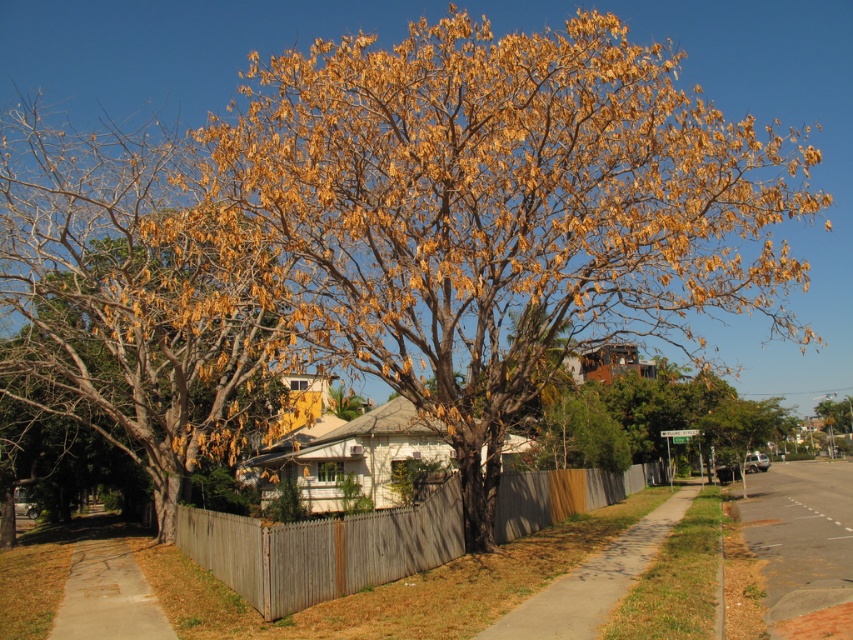
Is the position of brown/dried leaves at center more distant than that of dark gray asphalt at lower right?

That is True.

Does brown/dried leaves at center have a larger size compared to dark gray asphalt at lower right?

Yes.

Measure the distance between brown/dried leaves at center and camera.

They are 32.84 feet apart.

Where is `brown/dried leaves at center`? This screenshot has height=640, width=853. brown/dried leaves at center is located at coordinates (503, 211).

What do you see at coordinates (802, 545) in the screenshot?
I see `dark gray asphalt at lower right` at bounding box center [802, 545].

Based on the photo, who is positioned more to the left, dark gray asphalt at lower right or concrete sidewalk at lower left?

From the viewer's perspective, concrete sidewalk at lower left appears more on the left side.

Identify the location of dark gray asphalt at lower right. The width and height of the screenshot is (853, 640). (802, 545).

Find the location of a particular element. This screenshot has height=640, width=853. dark gray asphalt at lower right is located at coordinates (802, 545).

Is point (422, 234) behind point (589, 476)?

That is False.

Does brown/dried leaves at center have a larger size compared to wooden picket fence at center?

Yes.

The width and height of the screenshot is (853, 640). What are the coordinates of `brown/dried leaves at center` in the screenshot? It's located at (503, 211).